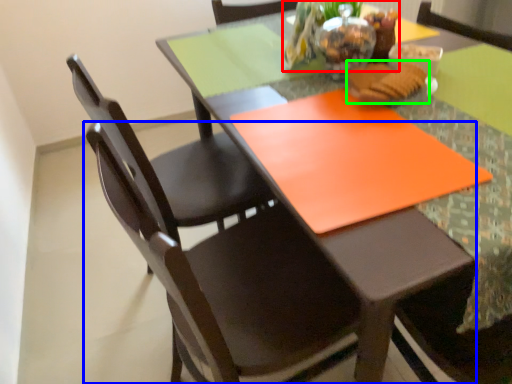
Question: Which object is positioned closest to floral arrangement (highlighted by a red box)? Select from chair (highlighted by a blue box) and food (highlighted by a green box).

Choices:
 (A) chair
 (B) food

Answer: (B)